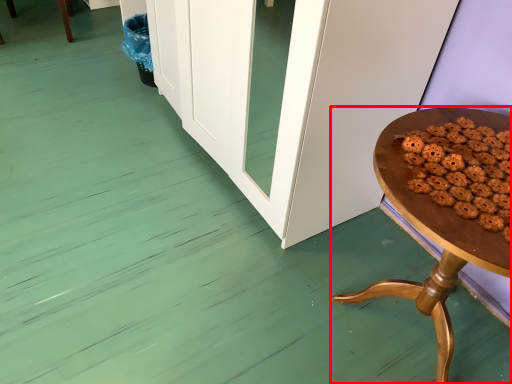
Question: Observing the image, what is the correct spatial positioning of table (annotated by the red box) in reference to food?

Choices:
 (A) right
 (B) left

Answer: (A)